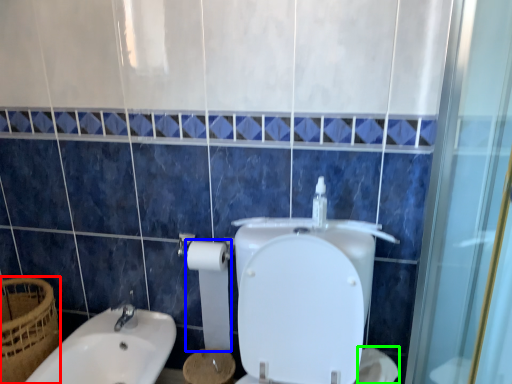
Question: Estimate the real-world distances between objects in this image. Which object is farther from basket (highlighted by a red box), toilet paper (highlighted by a blue box) or toilet paper (highlighted by a green box)?

Choices:
 (A) toilet paper
 (B) toilet paper

Answer: (B)